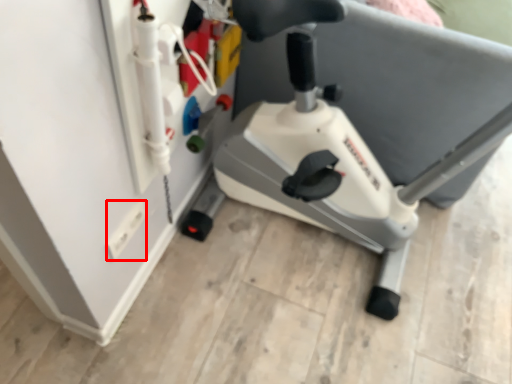
Question: Where is electric outlet (annotated by the red box) located in relation to stationary bicycle in the image?

Choices:
 (A) right
 (B) left

Answer: (B)